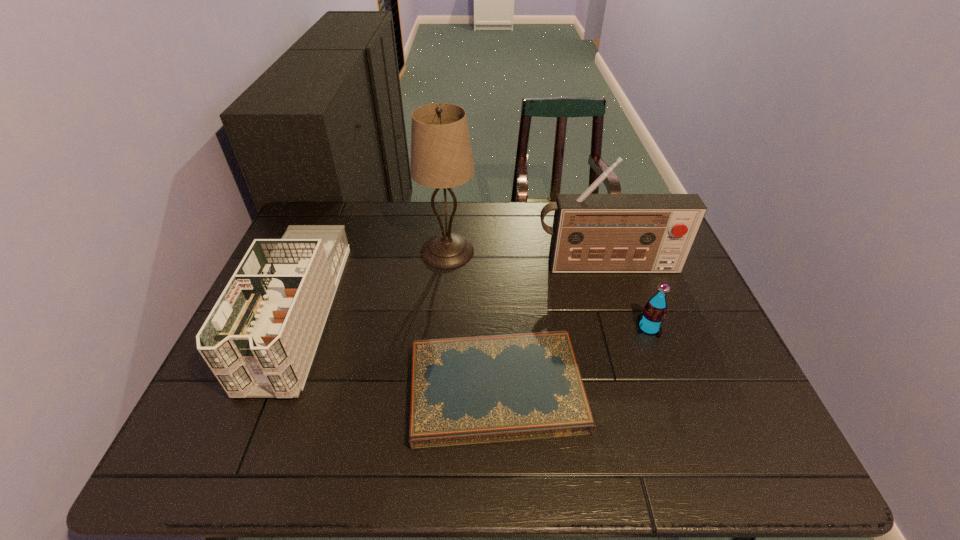
I want to click on vacant space that is in between the fourth shortest object and the lampshade, so click(527, 259).

What are the coordinates of `free space between the lampshade and the radio receiver` in the screenshot? It's located at (527, 259).

Identify the location of object that is the fourth closest to the tallest object. (650, 320).

You are a GUI agent. You are given a task and a screenshot of the screen. Output one action in this format:
    pyautogui.click(x=<x>, y=<y>)
    Task: Click on the object that is the fourth nearest to the fourth tallest object
    
    Given the screenshot: What is the action you would take?
    pyautogui.click(x=259, y=340)

Locate an element on the screen. This screenshot has height=540, width=960. free location that satisfies the following two spatial constraints: 1. on the front-facing side of the tallest object; 2. at the entrance of the third shortest object is located at coordinates (443, 313).

At what (x,y) coordinates should I click in order to perform the action: click on vacant area that satisfies the following two spatial constraints: 1. on the front-facing side of the lampshade; 2. on the left side of the fourth tallest object. Please return your answer as a coordinate pair (x, y). This screenshot has width=960, height=540. Looking at the image, I should click on (441, 328).

You are a GUI agent. You are given a task and a screenshot of the screen. Output one action in this format:
    pyautogui.click(x=<x>, y=<y>)
    Task: Click on the vacant space that satisfies the following two spatial constraints: 1. on the front panel of the second shortest object; 2. on the left side of the second tallest object
    Image resolution: width=960 pixels, height=540 pixels.
    Given the screenshot: What is the action you would take?
    pyautogui.click(x=626, y=328)

Where is `vacant space that satisfies the following two spatial constraints: 1. on the back side of the second shortest object; 2. on the front-facing side of the tallest object`? vacant space that satisfies the following two spatial constraints: 1. on the back side of the second shortest object; 2. on the front-facing side of the tallest object is located at coordinates (620, 251).

Identify the location of vacant space that satisfies the following two spatial constraints: 1. on the front-facing side of the fourth tallest object; 2. on the left side of the tallest object. (441, 328).

Where is `vacant space that satisfies the following two spatial constraints: 1. at the entrance of the fourth tallest object; 2. on the right side of the third tallest object`? This screenshot has height=540, width=960. vacant space that satisfies the following two spatial constraints: 1. at the entrance of the fourth tallest object; 2. on the right side of the third tallest object is located at coordinates (292, 328).